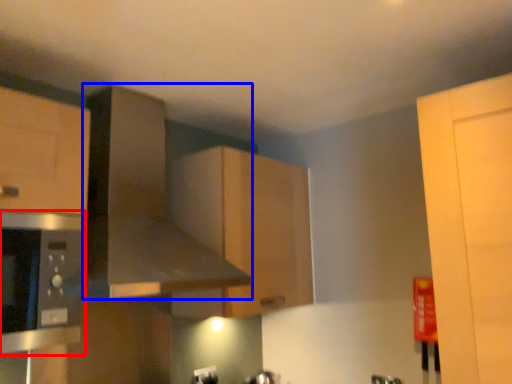
Question: Which object is further to the camera taking this photo, appliance (highlighted by a red box) or exhaust hood (highlighted by a blue box)?

Choices:
 (A) appliance
 (B) exhaust hood

Answer: (B)